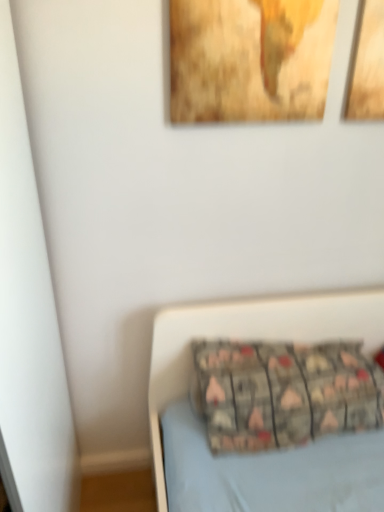
Question: In the image, is patterned fabric pillow at lower center on the left side or the right side of wooden textured picture frame at upper center?

Choices:
 (A) right
 (B) left

Answer: (A)

Question: Considering the positions of patterned fabric pillow at lower center and wooden textured picture frame at upper center in the image, is patterned fabric pillow at lower center bigger or smaller than wooden textured picture frame at upper center?

Choices:
 (A) small
 (B) big

Answer: (B)

Question: Relative to wooden textured picture frame at upper center, is patterned fabric pillow at lower center in front or behind?

Choices:
 (A) front
 (B) behind

Answer: (B)

Question: Is wooden textured picture frame at upper center spatially inside patterned fabric pillow at lower center, or outside of it?

Choices:
 (A) outside
 (B) inside

Answer: (A)

Question: In terms of size, does wooden textured picture frame at upper center appear bigger or smaller than patterned fabric pillow at lower center?

Choices:
 (A) small
 (B) big

Answer: (A)

Question: Considering the relative positions of wooden textured picture frame at upper center and patterned fabric pillow at lower center in the image provided, is wooden textured picture frame at upper center to the left or to the right of patterned fabric pillow at lower center?

Choices:
 (A) right
 (B) left

Answer: (B)

Question: From a real-world perspective, is wooden textured picture frame at upper center positioned above or below patterned fabric pillow at lower center?

Choices:
 (A) below
 (B) above

Answer: (B)